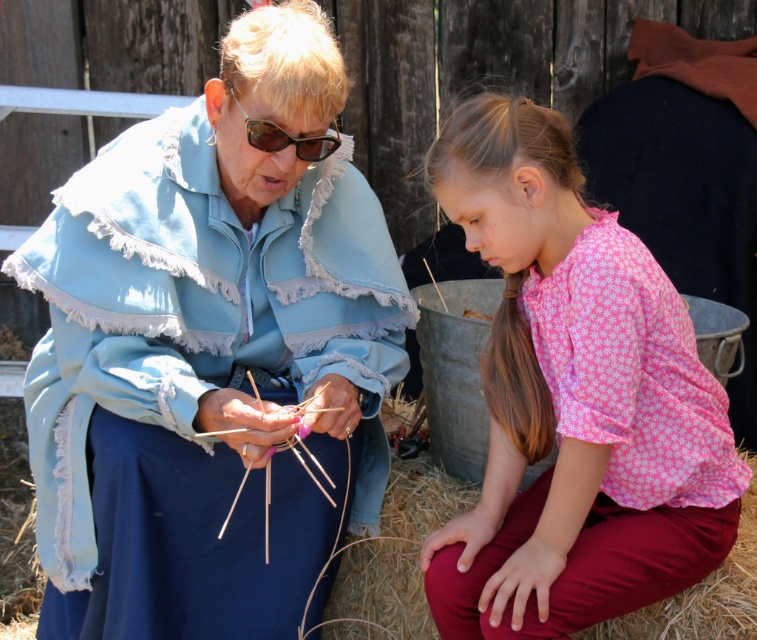
Describe the element at coordinates (210, 355) in the screenshot. I see `light blue fabric at center` at that location.

Which is below, light blue fabric at center or matte black goggles at upper center?

light blue fabric at center is lower down.

Where is `light blue fabric at center`? light blue fabric at center is located at coordinates click(x=210, y=355).

The width and height of the screenshot is (757, 640). I want to click on light blue fabric at center, so click(x=210, y=355).

How much distance is there between light blue fabric at center and pink floral shirt at lower right?

20.57 inches

Does point (357, 394) lie in front of point (541, 365)?

No, (357, 394) is behind (541, 365).

Where is `light blue fabric at center`? This screenshot has width=757, height=640. light blue fabric at center is located at coordinates (210, 355).

How distant is pink floral shirt at lower right from matte black goggles at upper center?

pink floral shirt at lower right and matte black goggles at upper center are 65.98 centimeters apart.

How far apart are pink floral shirt at lower right and matte black goggles at upper center?

pink floral shirt at lower right is 25.98 inches away from matte black goggles at upper center.

Based on the photo, who is more distant from viewer, (690, 426) or (282, 132)?

Positioned behind is point (282, 132).

In order to click on pink floral shirt at lower right in this screenshot , I will do `click(572, 401)`.